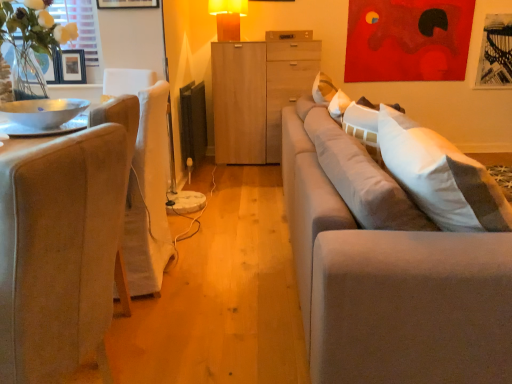
Question: From the image's perspective, relative to light wood cabinet at center, is wooden drawer at center above or below?

Choices:
 (A) below
 (B) above

Answer: (B)

Question: Considering the positions of wooden drawer at center and light wood cabinet at center in the image, is wooden drawer at center wider or thinner than light wood cabinet at center?

Choices:
 (A) thin
 (B) wide

Answer: (A)

Question: Estimate the real-world distances between objects in this image. Which object is farther from the matte yellow plastic table lamp at upper center?

Choices:
 (A) white fabric window screen at upper left
 (B) beige fabric chair at left
 (C) light wood cabinet at center
 (D) metallic silver bowl at left
 (E) light gray fabric couch at right

Answer: (B)

Question: Which object is the farthest from the wooden picture frame at upper left?

Choices:
 (A) metallic silver bowl at left
 (B) light gray fabric couch at right
 (C) light wood cabinet at center
 (D) white fabric window screen at upper left
 (E) wooden drawer at center

Answer: (B)